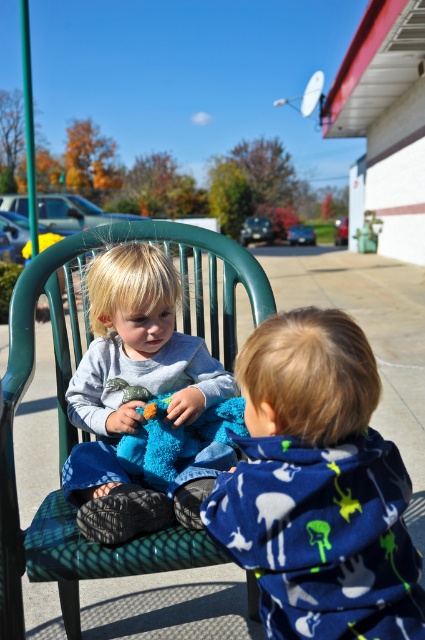
You are a parent trying to dress your child for a cold day. You have two options in front of you, the blue fleece hoodie at center and the soft gray sweater at center. Which one should you choose if you want the larger item to provide more warmth?

The soft gray sweater at center is larger than the blue fleece hoodie at center, so you should choose the soft gray sweater at center for more warmth.

You are a delivery person who needs to place a large package on the ground between the blue fleece hoodie at center and the green fabric rocking chair at center. Which object should you move to make space?

The blue fleece hoodie at center is thinner than the green fabric rocking chair at center, so you should move the blue fleece hoodie at center to create space for the package.